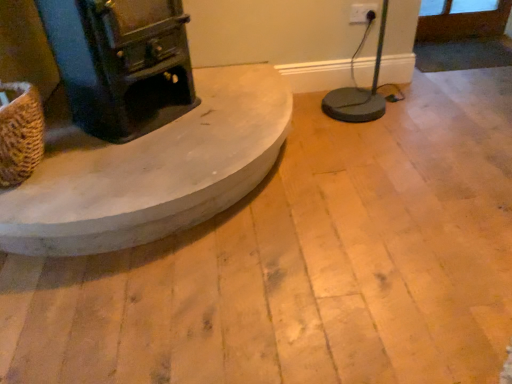
Locate an element on the screen. The width and height of the screenshot is (512, 384). brown woven basket at left is located at coordinates (20, 133).

Where is `white plastic electric outlet at upper right`? This screenshot has height=384, width=512. white plastic electric outlet at upper right is located at coordinates (362, 13).

Which is less distant, (0, 168) or (26, 227)?

The point (26, 227) is closer to the camera.

Looking at the image, does brown woven basket at left seem bigger or smaller compared to smooth concrete hearth at center?

Considering their sizes, brown woven basket at left takes up less space than smooth concrete hearth at center.

From the image's perspective, is brown woven basket at left above smooth concrete hearth at center?

Yes, from the image's perspective, brown woven basket at left is above smooth concrete hearth at center.

Considering the sizes of brown woven basket at left and smooth concrete hearth at center in the image, is brown woven basket at left wider or thinner than smooth concrete hearth at center?

In the image, brown woven basket at left appears to be more narrow than smooth concrete hearth at center.

Is brown woven basket at left positioned before white plastic electric outlet at upper right?

Yes, brown woven basket at left is in front of white plastic electric outlet at upper right.

Considering the relative sizes of brown woven basket at left and white plastic electric outlet at upper right in the image provided, is brown woven basket at left thinner than white plastic electric outlet at upper right?

No, brown woven basket at left is not thinner than white plastic electric outlet at upper right.

Is brown woven basket at left aimed at white plastic electric outlet at upper right?

No, brown woven basket at left is not facing towards white plastic electric outlet at upper right.

Would you say brown woven basket at left is a long distance from white plastic electric outlet at upper right?

Indeed, brown woven basket at left is not near white plastic electric outlet at upper right.

Considering the sizes of objects white plastic electric outlet at upper right and brown woven basket at left in the image provided, who is bigger, white plastic electric outlet at upper right or brown woven basket at left?

Bigger between the two is brown woven basket at left.

Locate an element on the screen. basket that appears below the white plastic electric outlet at upper right (from the image's perspective) is located at coordinates (20, 133).

Between point (371, 11) and point (38, 145), which one is positioned in front?

The point (38, 145) is more forward.

Between white plastic electric outlet at upper right and brown woven basket at left, which one appears on the left side from the viewer's perspective?

brown woven basket at left.

From a real-world perspective, between white plastic electric outlet at upper right and smooth concrete hearth at center, who is vertically lower?

smooth concrete hearth at center, from a real-world perspective.

Can you confirm if white plastic electric outlet at upper right is bigger than smooth concrete hearth at center?

No.

Are white plastic electric outlet at upper right and smooth concrete hearth at center far apart?

Absolutely, white plastic electric outlet at upper right is distant from smooth concrete hearth at center.

Considering the sizes of objects white plastic electric outlet at upper right and smooth concrete hearth at center in the image provided, who is wider, white plastic electric outlet at upper right or smooth concrete hearth at center?

smooth concrete hearth at center.

Is smooth concrete hearth at center aimed at white plastic electric outlet at upper right?

No, smooth concrete hearth at center does not turn towards white plastic electric outlet at upper right.

At what (x,y) coordinates should I click in order to perform the action: click on electric outlet located above the smooth concrete hearth at center (from a real-world perspective). Please return your answer as a coordinate pair (x, y). Looking at the image, I should click on (362, 13).

Who is more distant, smooth concrete hearth at center or white plastic electric outlet at upper right?

white plastic electric outlet at upper right is behind.

Looking at their sizes, would you say smooth concrete hearth at center is wider or thinner than white plastic electric outlet at upper right?

In the image, smooth concrete hearth at center appears to be wider than white plastic electric outlet at upper right.

From the image's perspective, which one is positioned higher, smooth concrete hearth at center or brown woven basket at left?

brown woven basket at left is shown above in the image.

The width and height of the screenshot is (512, 384). I want to click on basket on the left side of smooth concrete hearth at center, so click(20, 133).

From a real-world perspective, is smooth concrete hearth at center beneath brown woven basket at left?

Yes, from a real-world perspective, smooth concrete hearth at center is under brown woven basket at left.

Consider the image. How many degrees apart are the facing directions of smooth concrete hearth at center and brown woven basket at left?

The facing directions of smooth concrete hearth at center and brown woven basket at left are 2.52 degrees apart.

Image resolution: width=512 pixels, height=384 pixels. I want to click on basket above the smooth concrete hearth at center (from a real-world perspective), so click(20, 133).

This screenshot has width=512, height=384. What are the coordinates of `electric outlet above the brown woven basket at left (from the image's perspective)` in the screenshot? It's located at (362, 13).

When comparing their distances from white plastic electric outlet at upper right, does smooth concrete hearth at center or brown woven basket at left seem closer?

smooth concrete hearth at center is closer to white plastic electric outlet at upper right.

Looking at the image, which one is located closer to white plastic electric outlet at upper right, brown woven basket at left or smooth concrete hearth at center?

smooth concrete hearth at center is positioned closer to the anchor white plastic electric outlet at upper right.

Considering their positions, is white plastic electric outlet at upper right positioned further to brown woven basket at left than smooth concrete hearth at center?

white plastic electric outlet at upper right is positioned further to the anchor brown woven basket at left.

From the image, which object appears to be nearer to brown woven basket at left, smooth concrete hearth at center or white plastic electric outlet at upper right?

smooth concrete hearth at center.

Considering their positions, is white plastic electric outlet at upper right positioned further to smooth concrete hearth at center than brown woven basket at left?

Among the two, white plastic electric outlet at upper right is located further to smooth concrete hearth at center.

Based on their spatial positions, is brown woven basket at left or white plastic electric outlet at upper right closer to smooth concrete hearth at center?

Based on the image, brown woven basket at left appears to be nearer to smooth concrete hearth at center.

The image size is (512, 384). In order to click on furniture between brown woven basket at left and white plastic electric outlet at upper right from left to right in this screenshot , I will do `click(149, 169)`.